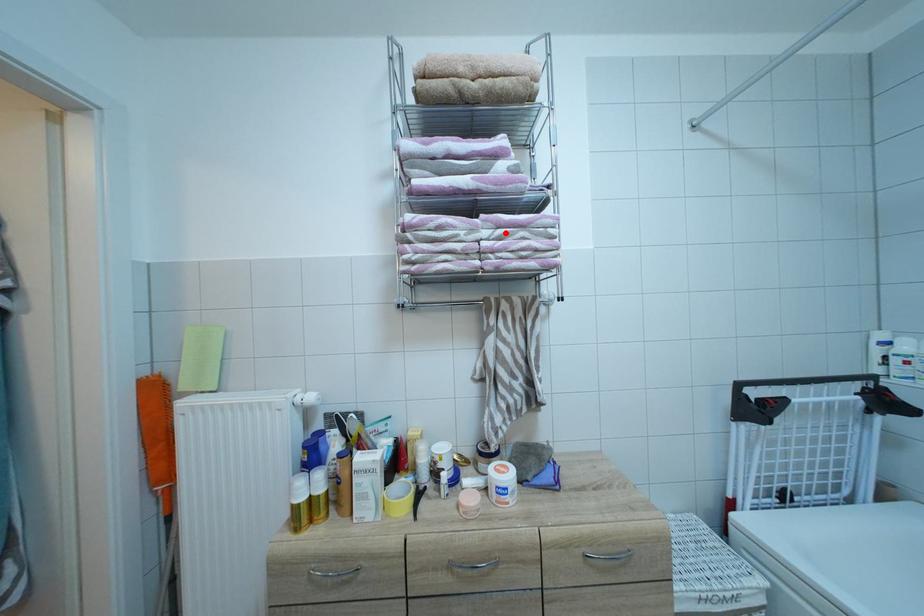
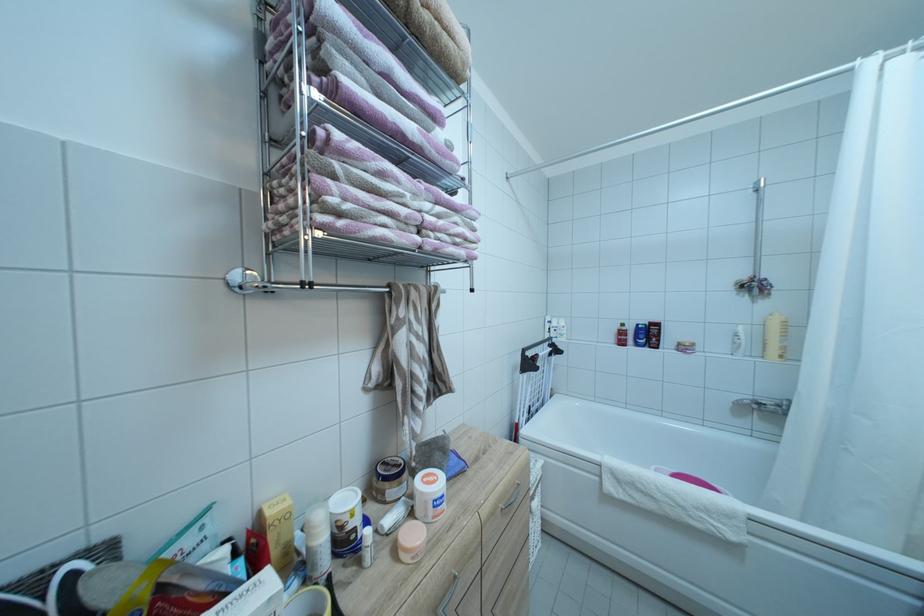
Where in the second image is the point corresponding to the highlighted location from the first image?

(444, 209)